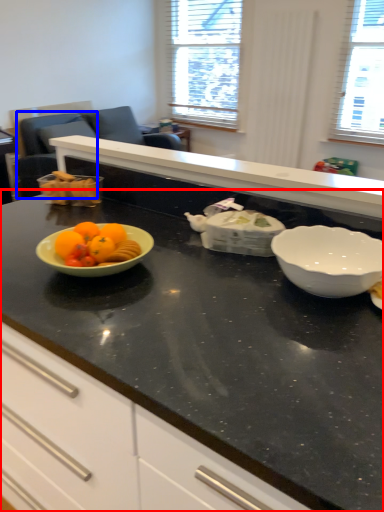
Question: Among these objects, which one is nearest to the camera, countertop (highlighted by a red box) or armchair (highlighted by a blue box)?

Choices:
 (A) countertop
 (B) armchair

Answer: (A)